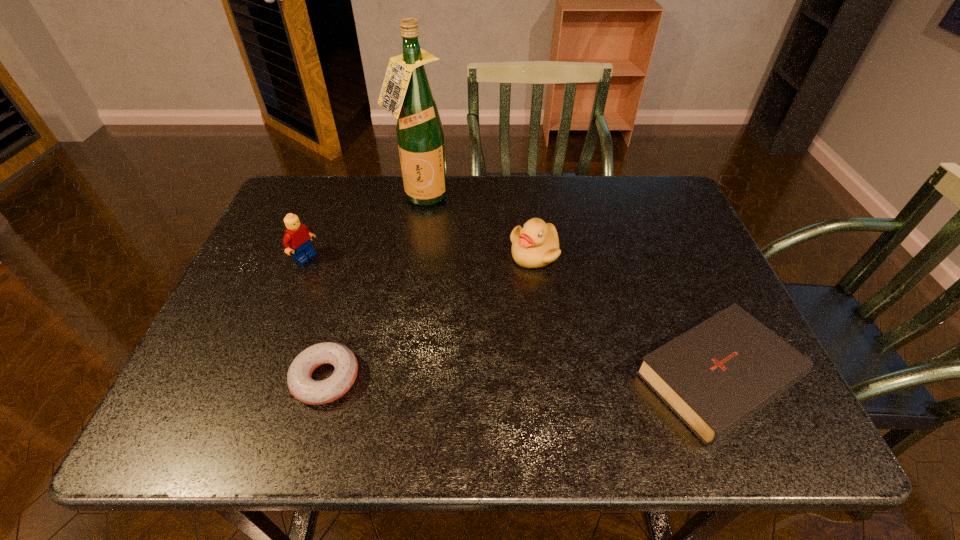
I want to click on empty location between the liquor and the rightmost object, so 575,288.

Identify which object is the third closest to the rightmost object. Please provide its 2D coordinates. Your answer should be formatted as a tuple, i.e. [(x, y)], where the tuple contains the x and y coordinates of a point satisfying the conditions above.

[(300, 383)]

Find the location of `object that stands as the second closest to the second tallest object`. object that stands as the second closest to the second tallest object is located at coordinates (300, 383).

Identify the location of vacant area that satisfies the following two spatial constraints: 1. on the back side of the fourth shortest object; 2. on the left side of the farthest object. (329, 199).

This screenshot has width=960, height=540. Identify the location of vacant space that satisfies the following two spatial constraints: 1. on the front side of the farthest object; 2. on the right side of the third tallest object. (412, 253).

In order to click on vacant space that satisfies the following two spatial constraints: 1. on the back side of the tallest object; 2. on the right side of the fourth shortest object in this screenshot , I will do `click(329, 199)`.

This screenshot has height=540, width=960. I want to click on free space that satisfies the following two spatial constraints: 1. on the back side of the second object from right to left; 2. on the right side of the shortest object, so click(360, 253).